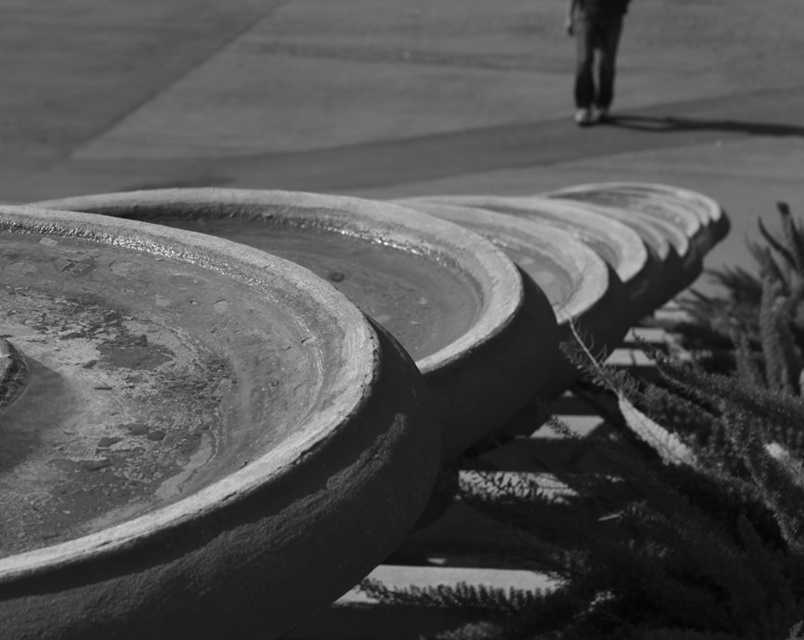
Question: Is fuzzy green plant at center thinner than dark jeans at upper right?

Choices:
 (A) yes
 (B) no

Answer: (B)

Question: Is fuzzy green plant at center bigger than dark jeans at upper right?

Choices:
 (A) yes
 (B) no

Answer: (A)

Question: Which of the following is the farthest from the observer?

Choices:
 (A) (712, 612)
 (B) (575, 100)

Answer: (B)

Question: Is fuzzy green plant at center bigger than dark jeans at upper right?

Choices:
 (A) no
 (B) yes

Answer: (B)